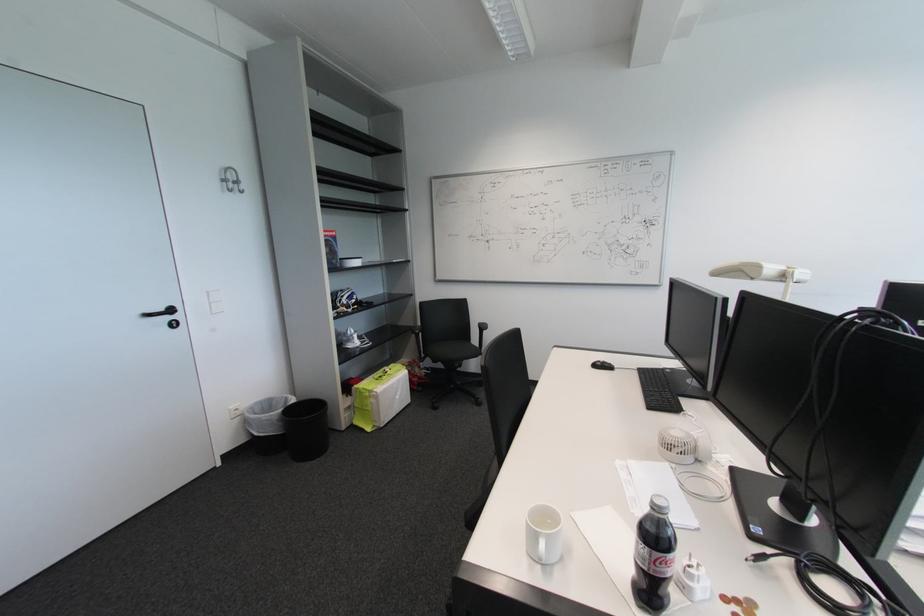
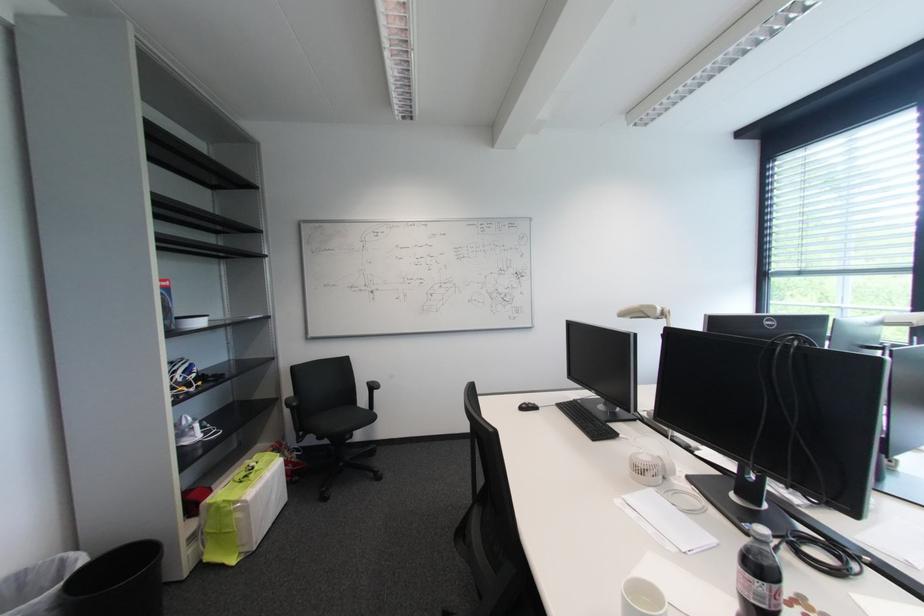
Find the pixel in the second image that matches (649,546) in the first image.

(766, 583)